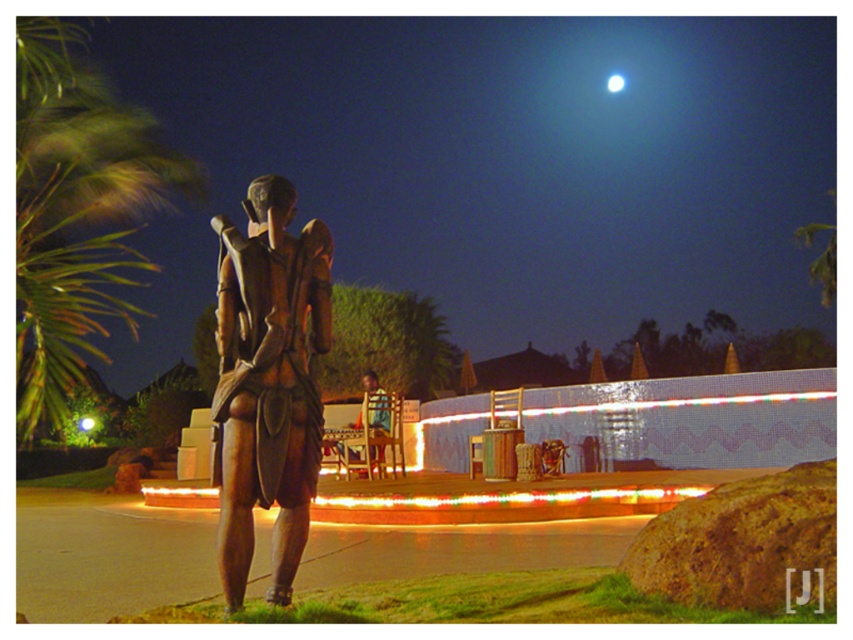
Question: Which object is positioned closest to the wooden chair at center?

Choices:
 (A) bronze statue at center
 (B) bright white sphere at upper center
 (C) green leafy palm tree at left

Answer: (A)

Question: Does green leafy palm tree at left come behind wooden chair at center?

Choices:
 (A) no
 (B) yes

Answer: (A)

Question: Is green leafy palm tree at left closer to the viewer compared to wooden chair at center?

Choices:
 (A) yes
 (B) no

Answer: (A)

Question: Which object is closer to the camera taking this photo?

Choices:
 (A) bright white sphere at upper center
 (B) bronze statue at center

Answer: (B)

Question: Which of the following is the farthest from the observer?

Choices:
 (A) bronze statue at center
 (B) bright white sphere at upper center

Answer: (B)

Question: Can you confirm if green leafy palm tree at left is smaller than bright white sphere at upper center?

Choices:
 (A) yes
 (B) no

Answer: (B)